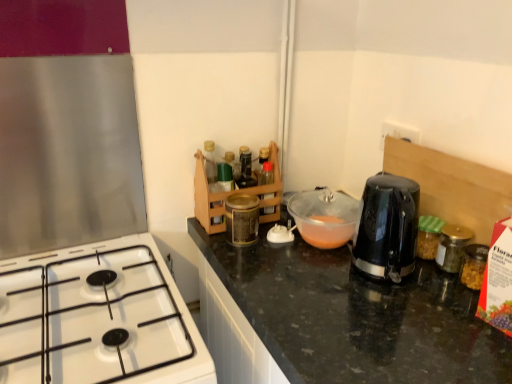
Question: From the image's perspective, is white glossy gas stove at lower left located above or below gold metallic jar at right?

Choices:
 (A) below
 (B) above

Answer: (A)

Question: Relative to gold metallic jar at right, is white glossy gas stove at lower left in front or behind?

Choices:
 (A) behind
 (B) front

Answer: (B)

Question: Based on their relative distances, which object is farther from the translucent plastic bowl at center?

Choices:
 (A) white glossy gas stove at lower left
 (B) gold metallic jar at right

Answer: (A)

Question: Which is nearer to the translucent plastic bowl at center?

Choices:
 (A) white glossy gas stove at lower left
 (B) gold metallic jar at right

Answer: (B)